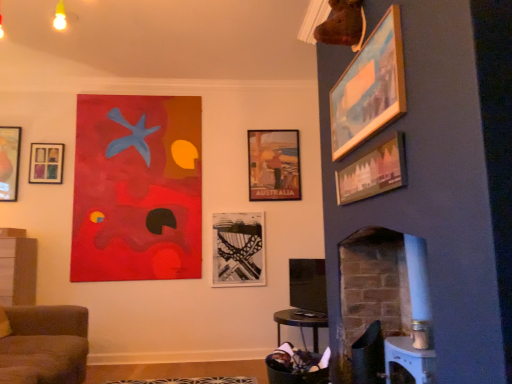
Question: From the image's perspective, is matte wooden picture frame at upper right, marked as the 5th picture frame in a left-to-right arrangement, over black textured roller coaster at center, the second picture frame in the back-to-front sequence?

Choices:
 (A) no
 (B) yes

Answer: (B)

Question: Does matte wooden picture frame at upper right, the 6th picture frame when ordered from back to front, have a greater height compared to black textured roller coaster at center, which appears as the 4th picture frame when viewed from the right?

Choices:
 (A) yes
 (B) no

Answer: (B)

Question: Does matte wooden picture frame at upper right, marked as the 5th picture frame in a left-to-right arrangement, come in front of black textured roller coaster at center, which appears as the 4th picture frame when viewed from the right?

Choices:
 (A) yes
 (B) no

Answer: (A)

Question: From a real-world perspective, is matte wooden picture frame at upper right, marked as the 5th picture frame in a left-to-right arrangement, under black textured roller coaster at center, which appears as the 4th picture frame when viewed from the right?

Choices:
 (A) yes
 (B) no

Answer: (B)

Question: Considering the relative sizes of matte wooden picture frame at upper right, marked as the 5th picture frame in a left-to-right arrangement, and black textured roller coaster at center, which appears as the 4th picture frame when viewed from the right, in the image provided, is matte wooden picture frame at upper right, marked as the 5th picture frame in a left-to-right arrangement, bigger than black textured roller coaster at center, which appears as the 4th picture frame when viewed from the right,?

Choices:
 (A) yes
 (B) no

Answer: (B)

Question: Could you tell me if matte wooden picture frame at upper right, marked as the 5th picture frame in a left-to-right arrangement, is facing black textured roller coaster at center, which is the third picture frame in left-to-right order?

Choices:
 (A) no
 (B) yes

Answer: (A)

Question: Considering the relative sizes of matte black picture frame at upper left, the 4th picture frame positioned from the back, and brown fabric couch at lower left in the image provided, is matte black picture frame at upper left, the 4th picture frame positioned from the back, smaller than brown fabric couch at lower left?

Choices:
 (A) yes
 (B) no

Answer: (A)

Question: Can you confirm if matte black picture frame at upper left, the 4th picture frame positioned from the back, is positioned to the left of brown fabric couch at lower left?

Choices:
 (A) yes
 (B) no

Answer: (A)

Question: From the image's perspective, is matte black picture frame at upper left, placed as the sixth picture frame when sorted from right to left, located beneath brown fabric couch at lower left?

Choices:
 (A) yes
 (B) no

Answer: (B)

Question: Could you tell me if matte black picture frame at upper left, positioned as the 3th picture frame in front-to-back order, is turned towards brown fabric couch at lower left?

Choices:
 (A) yes
 (B) no

Answer: (B)

Question: Would you say brown fabric couch at lower left is part of matte black picture frame at upper left, the 4th picture frame positioned from the back,'s contents?

Choices:
 (A) yes
 (B) no

Answer: (B)

Question: Is the surface of matte black picture frame at upper left, the first picture frame viewed from the left, in direct contact with brown fabric couch at lower left?

Choices:
 (A) no
 (B) yes

Answer: (A)

Question: Is matte wooden picture frame at upper right, the 6th picture frame when ordered from back to front, looking in the opposite direction of wooden picture frame at upper right, placed as the 6th picture frame when sorted from left to right?

Choices:
 (A) yes
 (B) no

Answer: (B)